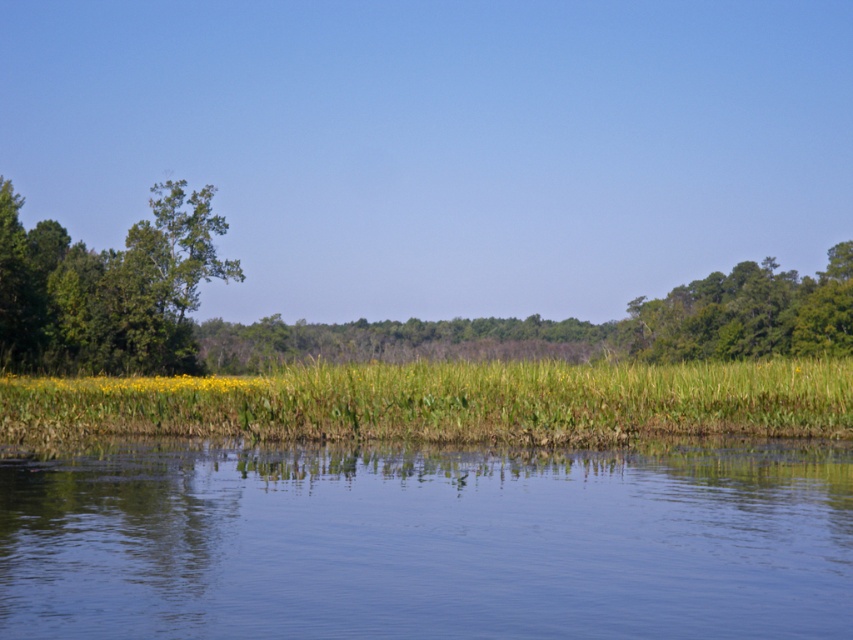
Can you confirm if transparent water at center is taller than green leafy trees at upper right?

No.

Can you confirm if transparent water at center is smaller than green leafy trees at upper right?

Yes.

Is point (621, 598) positioned after point (733, 330)?

No, it is not.

Where is `transparent water at center`? transparent water at center is located at coordinates (425, 541).

Can you confirm if green grass at center is wider than green leafy tree at left?

Indeed, green grass at center has a greater width compared to green leafy tree at left.

Does green grass at center have a lesser height compared to green leafy tree at left?

Correct, green grass at center is not as tall as green leafy tree at left.

Between point (561, 387) and point (181, 324), which one is positioned behind?

Positioned behind is point (181, 324).

You are a GUI agent. You are given a task and a screenshot of the screen. Output one action in this format:
    pyautogui.click(x=<x>, y=<y>)
    Task: Click on the green grass at center
    Image resolution: width=853 pixels, height=640 pixels.
    Given the screenshot: What is the action you would take?
    pyautogui.click(x=447, y=403)

Between point (109, 534) and point (273, 410), which one is positioned behind?

The point (273, 410) is more distant.

Can you confirm if transparent water at center is positioned to the left of green grass at center?

In fact, transparent water at center is to the right of green grass at center.

Between point (444, 520) and point (419, 369), which one is positioned in front?

Point (444, 520) is more forward.

Find the location of a particular element. The image size is (853, 640). transparent water at center is located at coordinates (425, 541).